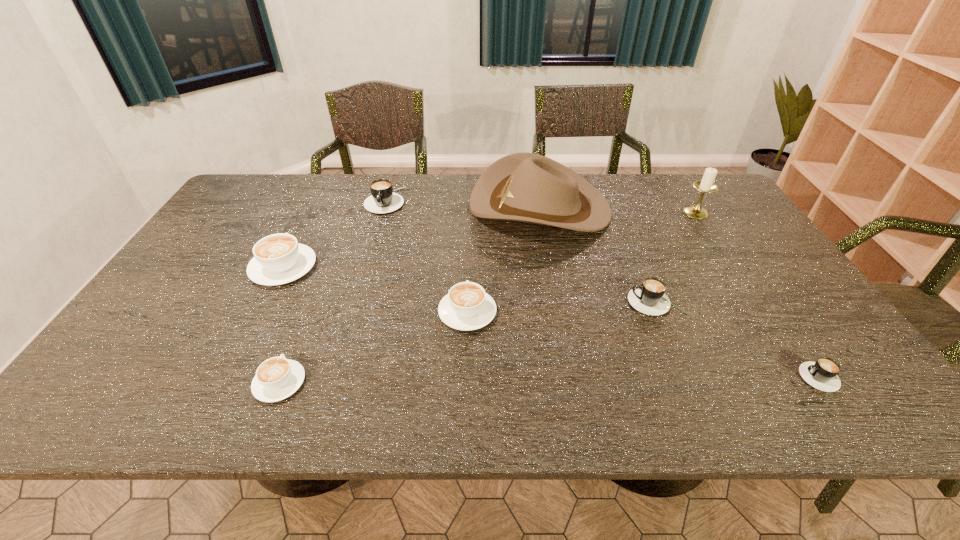
This screenshot has width=960, height=540. I want to click on vacant space at the left edge, so click(194, 245).

The width and height of the screenshot is (960, 540). In order to click on free region at the right edge of the desktop in this screenshot , I will do `click(784, 333)`.

Identify the location of free space at the far left corner of the desktop. Image resolution: width=960 pixels, height=540 pixels. (276, 206).

Locate an element on the screen. Image resolution: width=960 pixels, height=540 pixels. empty space between the second nearest black cappuccino and the cowboy hat is located at coordinates (598, 254).

At what (x,y) coordinates should I click in order to perform the action: click on empty location between the candle holder and the cowboy hat. Please return your answer as a coordinate pair (x, y). The height and width of the screenshot is (540, 960). Looking at the image, I should click on (618, 210).

Where is `vacant area that lies between the rightmost white cappuccino and the nearest black cappuccino`? vacant area that lies between the rightmost white cappuccino and the nearest black cappuccino is located at coordinates (646, 345).

Image resolution: width=960 pixels, height=540 pixels. What are the coordinates of `vacant point located between the candle holder and the second farthest black cappuccino` in the screenshot? It's located at (676, 257).

Locate an element on the screen. Image resolution: width=960 pixels, height=540 pixels. free spot between the smallest black cappuccino and the cowboy hat is located at coordinates (683, 292).

Find the location of a particular element. This screenshot has height=540, width=960. empty space between the fifth cappuccino from left to right and the cowboy hat is located at coordinates (598, 254).

Locate an element on the screen. The width and height of the screenshot is (960, 540). free space between the second nearest white cappuccino and the smallest white cappuccino is located at coordinates (373, 347).